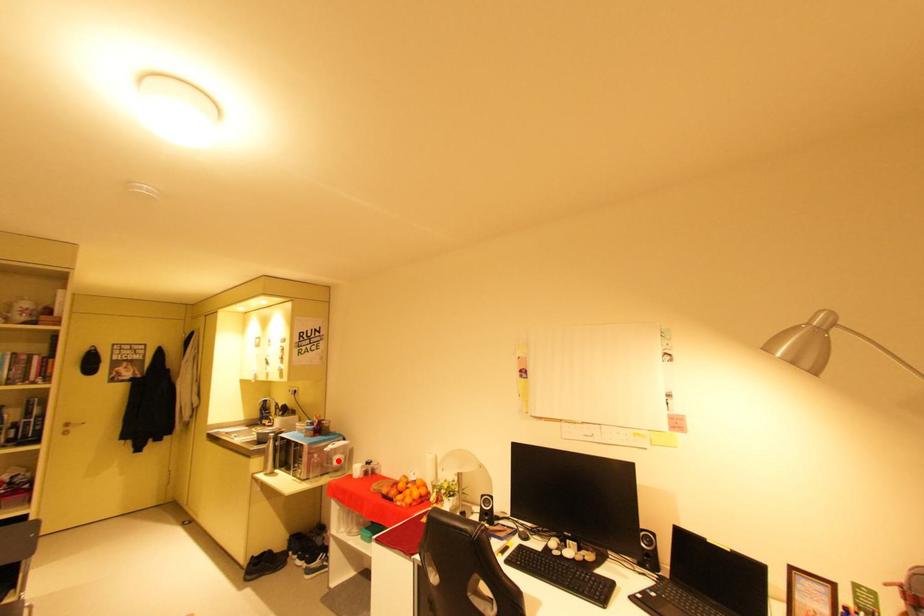
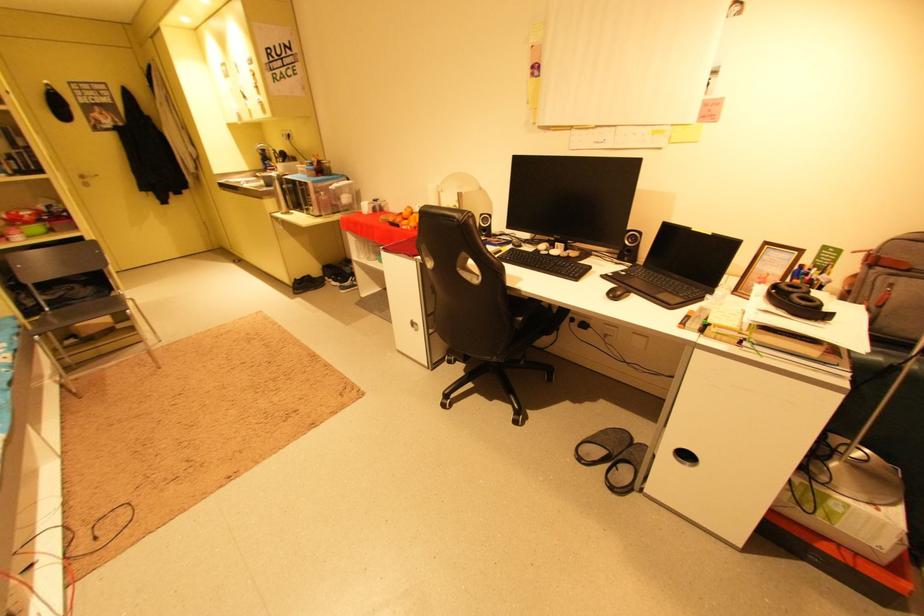
Find the pixel in the second image that matches the highlighted location in the first image.

(346, 200)